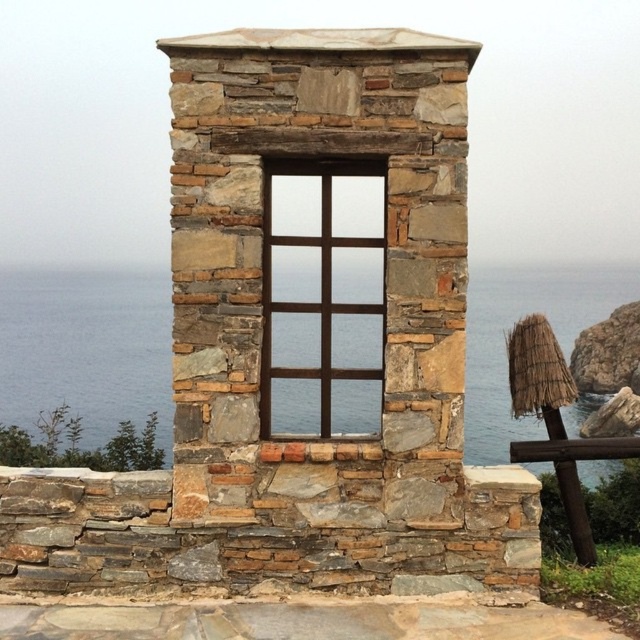
Measure the distance between natural stone window at center and camera.

natural stone window at center is 6.68 meters from camera.

Is natural stone window at center positioned in front of transparent glass water at center?

Yes, it is.

Is point (195, 420) farther from viewer compared to point (572, 320)?

No, (195, 420) is in front of (572, 320).

Locate an element on the screen. natural stone window at center is located at coordinates (269, 308).

Is natural stone window at center positioned in front of brown wooden window at center?

That is True.

Can you confirm if natural stone window at center is bigger than brown wooden window at center?

Yes, natural stone window at center is bigger than brown wooden window at center.

Find the location of a particular element. The image size is (640, 640). natural stone window at center is located at coordinates (269, 308).

What are the coordinates of `natural stone window at center` in the screenshot? It's located at (269, 308).

Who is positioned more to the left, transparent glass water at center or brown wooden window at center?

Positioned to the left is brown wooden window at center.

Measure the distance between point (595, 268) and camera.

The distance of point (595, 268) from camera is 21.57 meters.

You are a GUI agent. You are given a task and a screenshot of the screen. Output one action in this format:
    pyautogui.click(x=<x>, y=<y>)
    Task: Click on the transparent glass water at center
    This screenshot has width=640, height=640.
    Given the screenshot: What is the action you would take?
    pyautogui.click(x=84, y=348)